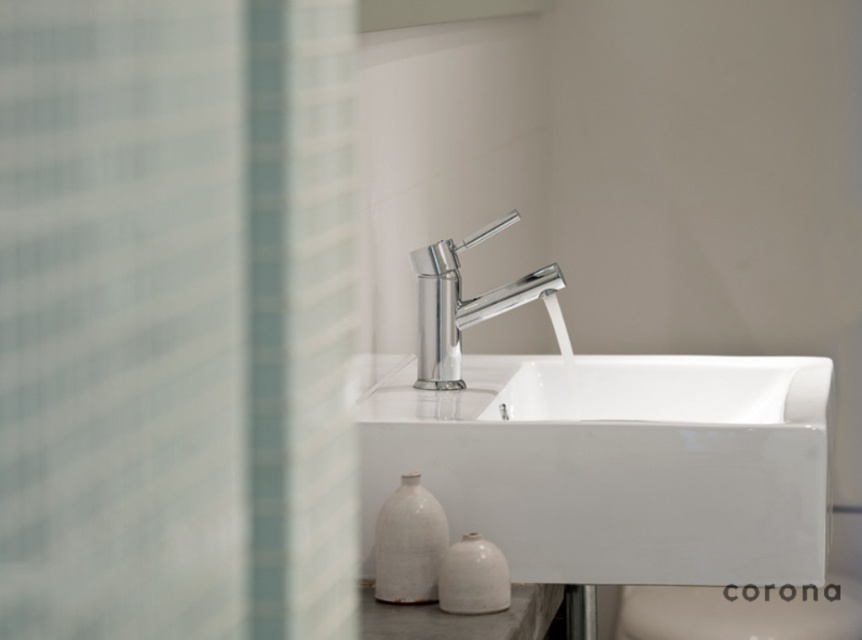
Question: Among these points, which one is nearest to the camera?

Choices:
 (A) (394, 586)
 (B) (457, 243)

Answer: (A)

Question: Can you confirm if chrome/metallic faucet at center is smaller than white matte vase at lower left?

Choices:
 (A) no
 (B) yes

Answer: (A)

Question: Does white ceramic toilet bowl at center come behind chrome/metallic faucet at center?

Choices:
 (A) no
 (B) yes

Answer: (A)

Question: Which point is farther to the camera?

Choices:
 (A) white ceramic sink at center
 (B) white matte vase at lower left
 (C) chrome/metallic faucet at center

Answer: (C)

Question: In this image, where is white ceramic sink at center located relative to white ceramic toilet bowl at center?

Choices:
 (A) left
 (B) right

Answer: (A)

Question: Which point is closer to the camera taking this photo?

Choices:
 (A) (375, 561)
 (B) (684, 637)
 (C) (419, 356)

Answer: (A)